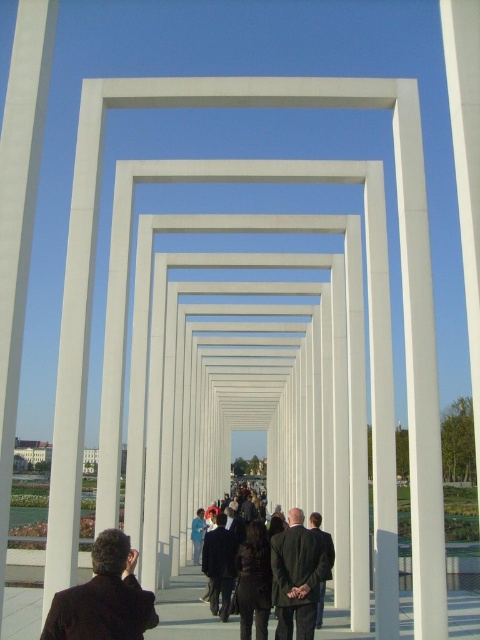
Question: Does dark brown suit at center appear on the left side of dark suit at center?

Choices:
 (A) no
 (B) yes

Answer: (B)

Question: Which point is farther to the camera?

Choices:
 (A) (117, 557)
 (B) (284, 579)

Answer: (B)

Question: Which point is closer to the camera?

Choices:
 (A) (289, 628)
 (B) (60, 630)
 (C) (304, 547)

Answer: (B)

Question: Which is nearer to the dark brown suit at center?

Choices:
 (A) dark suit at center
 (B) dark gray suit at center

Answer: (B)

Question: Is dark suit at center wider than dark gray suit at center?

Choices:
 (A) no
 (B) yes

Answer: (A)

Question: Considering the relative positions of dark suit at center and dark gray suit at center in the image provided, where is dark suit at center located with respect to dark gray suit at center?

Choices:
 (A) right
 (B) left

Answer: (B)